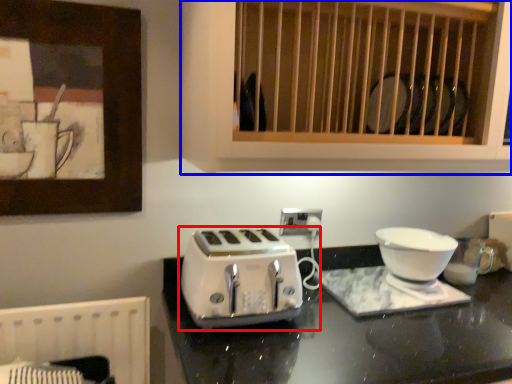
Question: Which of the following is the closest to the observer, toaster (highlighted by a red box) or cabinetry (highlighted by a blue box)?

Choices:
 (A) toaster
 (B) cabinetry

Answer: (B)